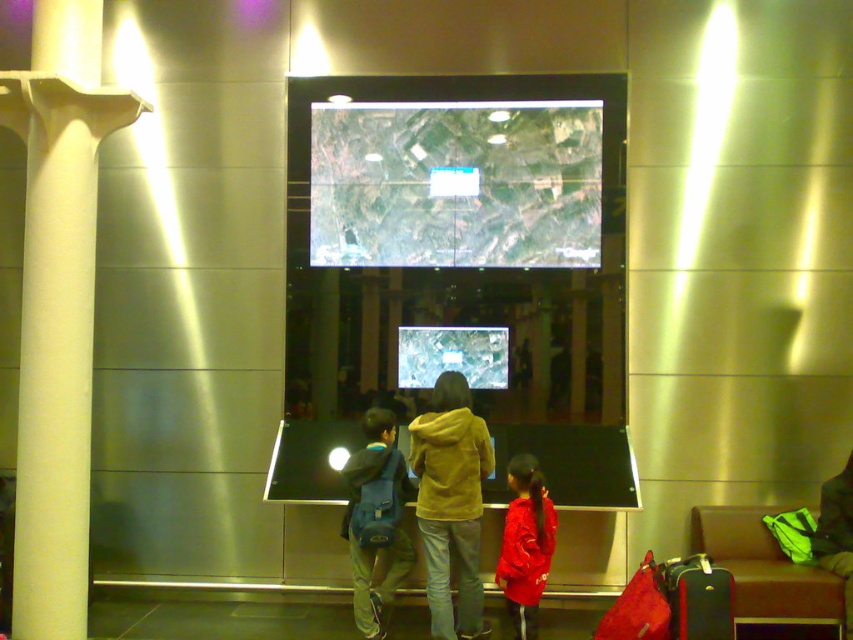
Question: Which object is positioned farthest from the red fleece jacket at lower right?

Choices:
 (A) yellow fleece jacket at center
 (B) green fabric bag at lower right
 (C) black fabric suitcase at lower right
 (D) matte red suitcase at lower right

Answer: (B)

Question: Is green fabric bag at lower right above matte red suitcase at lower right?

Choices:
 (A) yes
 (B) no

Answer: (A)

Question: Can you confirm if blue fabric backpack at center is thinner than red fleece jacket at lower right?

Choices:
 (A) yes
 (B) no

Answer: (B)

Question: Is yellow fleece jacket at center to the right of black fabric suitcase at lower right from the viewer's perspective?

Choices:
 (A) yes
 (B) no

Answer: (B)

Question: Which point appears farthest from the camera in this image?

Choices:
 (A) (842, 554)
 (B) (459, 564)

Answer: (B)

Question: Which of the following is the closest to the observer?

Choices:
 (A) green fabric bag at lower right
 (B) red fleece jacket at lower right
 (C) white smooth column at left

Answer: (C)